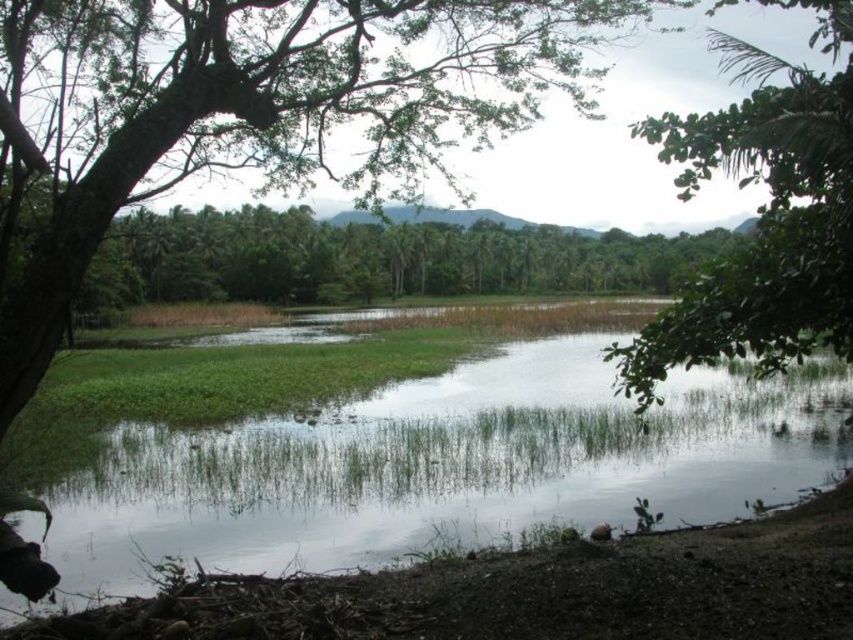
You are standing in the serene landscape and want to take a photo that includes both the green leafy tree at upper left and the green leafy tree at right. Which tree should you position closer to the camera to ensure both are in focus?

You should position the green leafy tree at upper left closer to the camera since it is already in front of the green leafy tree at right, allowing both to be in focus when framing the shot.

You are standing at the edge of the green grassy creek at center and want to look up at the green leafy tree at upper left. Which direction should you face to see the tree?

You should face the upper left direction to see the green leafy tree at upper left, as it is taller than the green grassy creek at center.